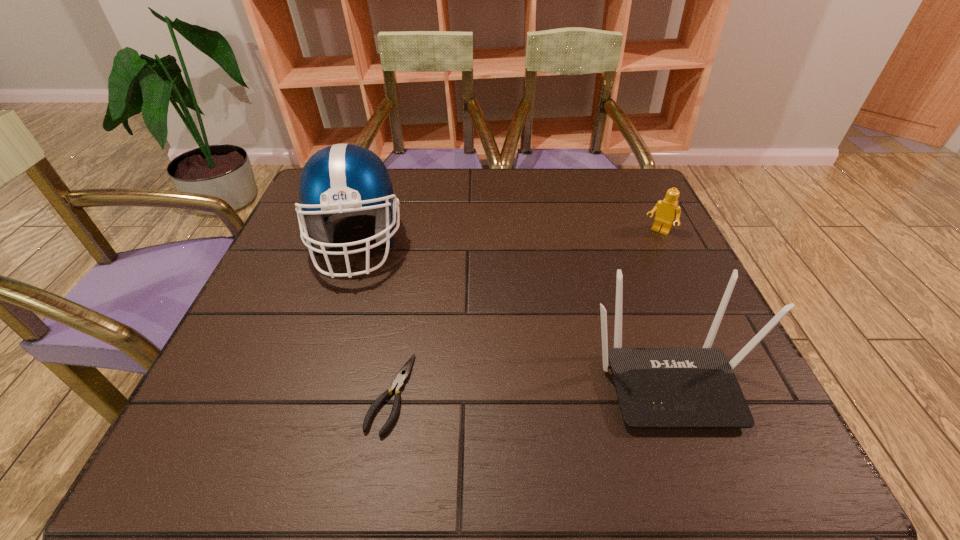
In the image, there is a desktop. At what (x,y) coordinates should I click in order to perform the action: click on free space at the left edge. Please return your answer as a coordinate pair (x, y). Image resolution: width=960 pixels, height=540 pixels. Looking at the image, I should click on (258, 318).

You are a GUI agent. You are given a task and a screenshot of the screen. Output one action in this format:
    pyautogui.click(x=<x>, y=<y>)
    Task: Click on the vacant space at the right edge of the desktop
    The width and height of the screenshot is (960, 540).
    Given the screenshot: What is the action you would take?
    pyautogui.click(x=650, y=256)

Identify the location of free space at the near left corner. Image resolution: width=960 pixels, height=540 pixels. click(x=274, y=410).

Locate an element on the screen. Image resolution: width=960 pixels, height=540 pixels. blank area at the far right corner is located at coordinates (609, 210).

Locate an element on the screen. This screenshot has height=540, width=960. free point between the football helmet and the shortest object is located at coordinates click(373, 319).

Identify the location of vacant region between the second shortest object and the tallest object. (508, 238).

I want to click on unoccupied position between the shortest object and the Lego, so pyautogui.click(x=524, y=313).

The width and height of the screenshot is (960, 540). Identify the location of vacant space that is in between the router and the tallest object. (512, 311).

Where is `free spot between the second tallest object and the tallest object`? free spot between the second tallest object and the tallest object is located at coordinates (512, 311).

I want to click on blank region between the router and the third tallest object, so [x=663, y=306].